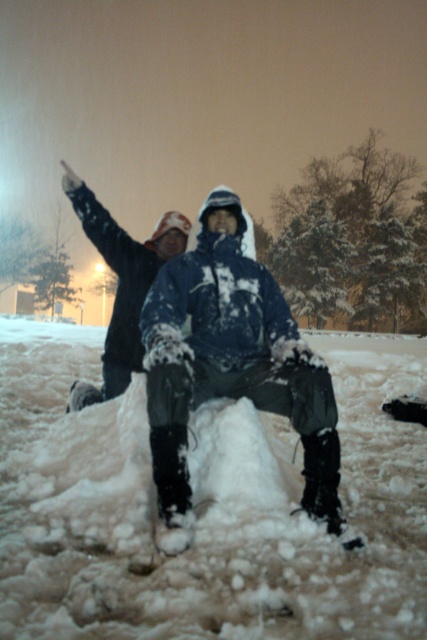
Is white fluffy snow at center shorter than snow-covered jacket at center?

Indeed, white fluffy snow at center has a lesser height compared to snow-covered jacket at center.

Between white fluffy snow at center and snow-covered jacket at center, which one is positioned higher?

snow-covered jacket at center is higher up.

Does point (366, 616) lie in front of point (245, 294)?

Yes, point (366, 616) is in front of point (245, 294).

Image resolution: width=427 pixels, height=640 pixels. Find the location of `white fluffy snow at center`. white fluffy snow at center is located at coordinates (204, 506).

Looking at this image, which is above, white fluffy snow at center or dark blue jacket at center?

dark blue jacket at center is above.

Identify the location of white fluffy snow at center. (204, 506).

Is snow-covered jacket at center to the right of dark blue jacket at center from the viewer's perspective?

Indeed, snow-covered jacket at center is positioned on the right side of dark blue jacket at center.

Which is behind, point (189, 291) or point (166, 220)?

Point (166, 220)

Does point (248, 385) lie behind point (114, 305)?

No, it is in front of (114, 305).

Where is `snow-covered jacket at center`? snow-covered jacket at center is located at coordinates (231, 369).